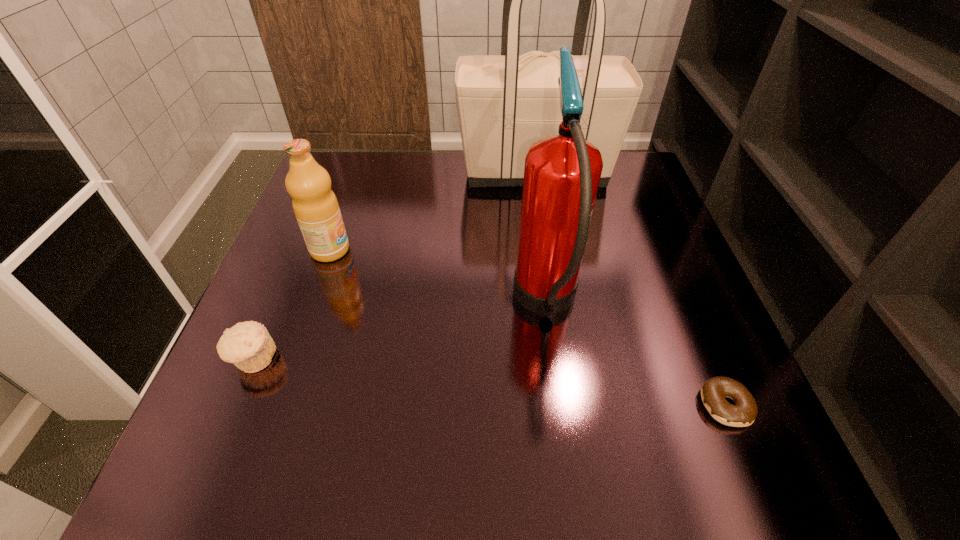
Image resolution: width=960 pixels, height=540 pixels. Find the location of `vacant space at the near edge of the desktop`. vacant space at the near edge of the desktop is located at coordinates (513, 477).

Where is `vacant space at the left edge`? The height and width of the screenshot is (540, 960). vacant space at the left edge is located at coordinates (287, 234).

At what (x,y) coordinates should I click in order to perform the action: click on free spot at the right edge of the desktop. Please return your answer as a coordinate pair (x, y). The image size is (960, 540). Looking at the image, I should click on (663, 423).

I want to click on vacant space at the far left corner, so (x=342, y=165).

In the image, there is a desktop. Identify the location of vacant space at the near left corner. This screenshot has width=960, height=540. (234, 487).

Identify the location of vacant space at the near right corner of the desktop. (771, 438).

Locate an element on the screen. Image resolution: width=960 pixels, height=540 pixels. free point between the muffin and the nearest object is located at coordinates (490, 382).

At what (x,y) coordinates should I click in order to perform the action: click on blank region between the farthest object and the fruit juice. Please return your answer as a coordinate pair (x, y). Looking at the image, I should click on (433, 211).

The height and width of the screenshot is (540, 960). Find the location of `vacant area that lies between the nearest object and the shopping bag`. vacant area that lies between the nearest object and the shopping bag is located at coordinates (631, 288).

Image resolution: width=960 pixels, height=540 pixels. In order to click on unoccupied position between the muffin and the farthest object in this screenshot , I will do `click(395, 265)`.